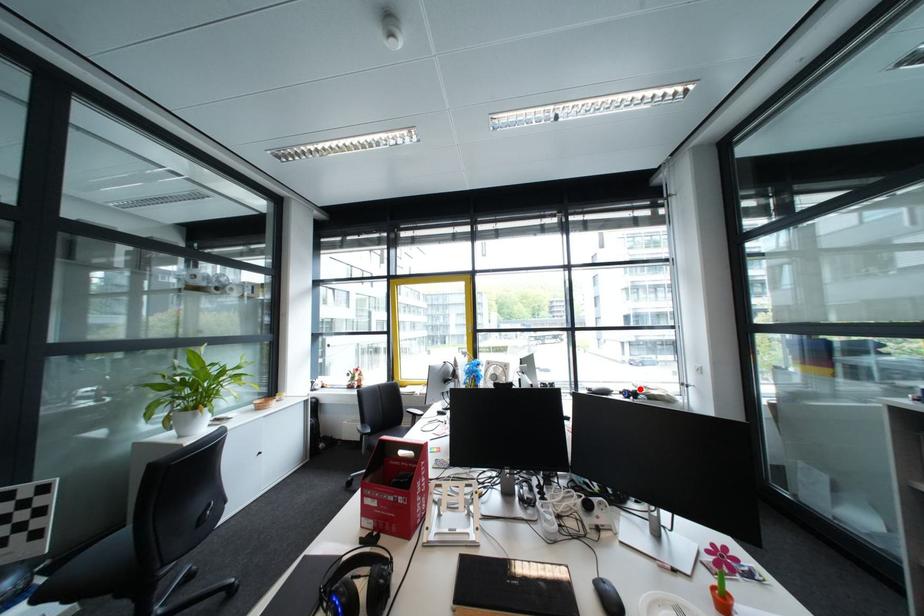
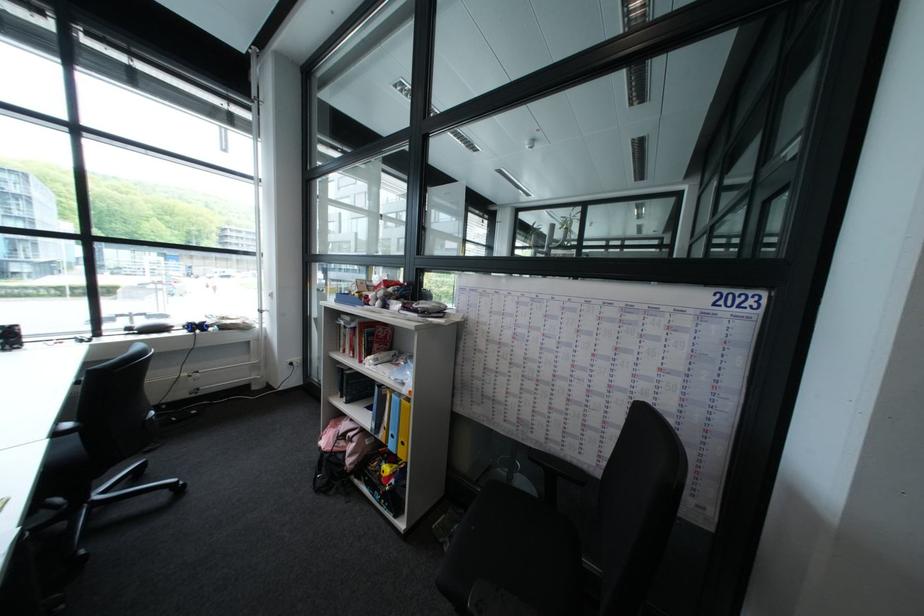
Where in the second image is the point corresponding to the highlighted location from the first image?

(203, 322)